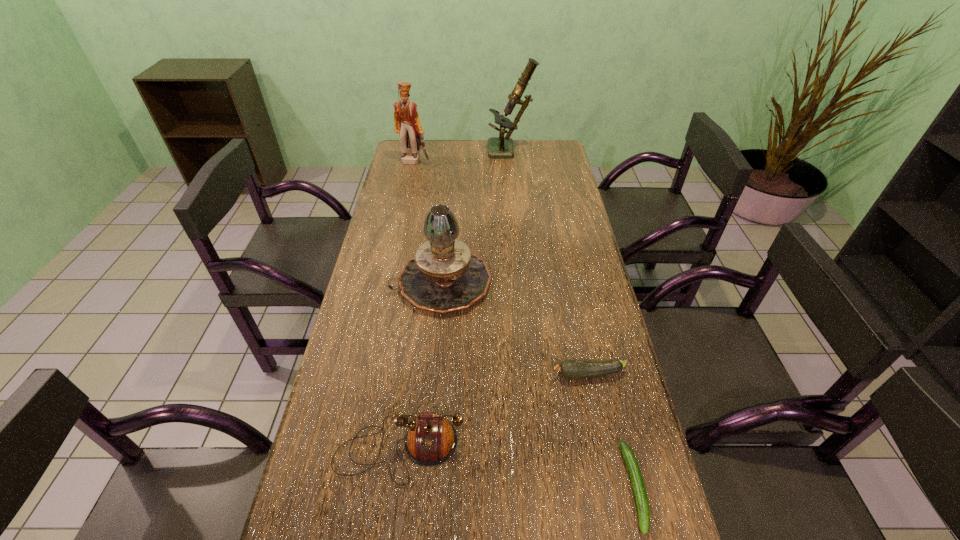
What are the coordinates of `vacant region that satisfies the following two spatial constraints: 1. at the blossom end of the taller zucchini; 2. on the rotary dial of the telephone` in the screenshot? It's located at (604, 449).

Identify the location of vacant point that satisfies the following two spatial constraints: 1. on the front-facing side of the third tallest object; 2. on the left side of the nutcracker. This screenshot has height=540, width=960. (390, 283).